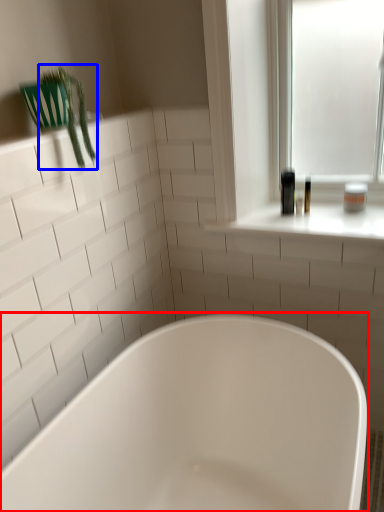
Question: Among these objects, which one is nearest to the camera, bathtub (highlighted by a red box) or plant (highlighted by a blue box)?

Choices:
 (A) bathtub
 (B) plant

Answer: (A)